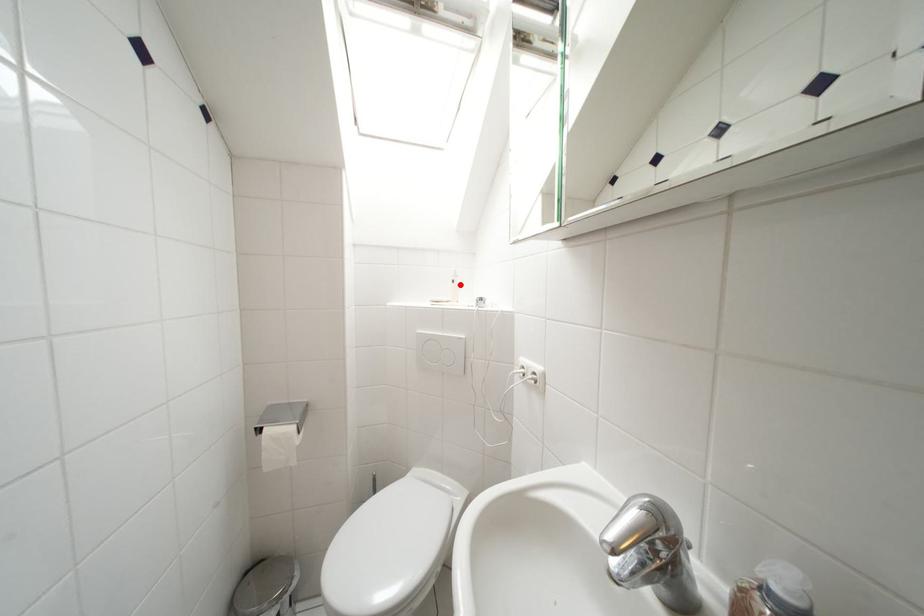
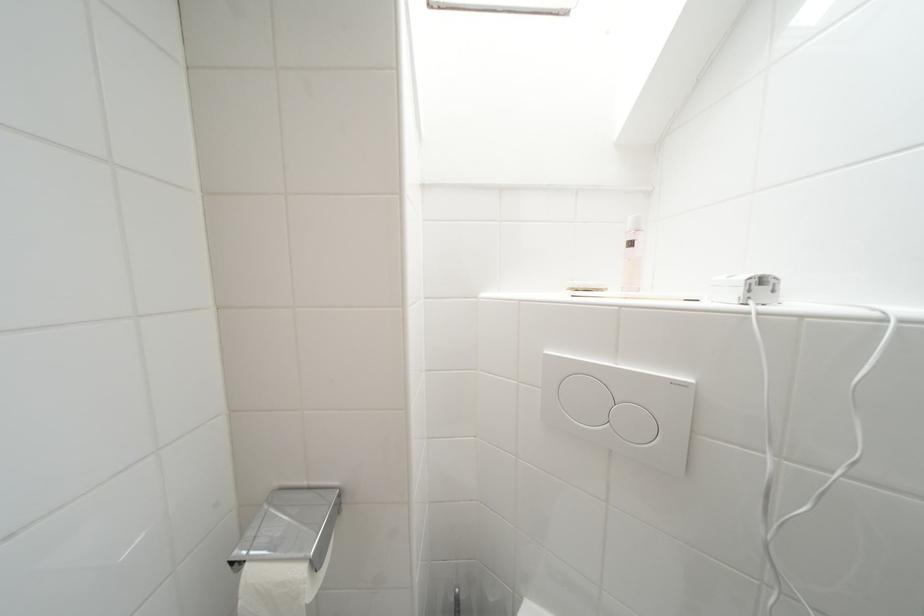
Locate, in the second image, the point that corresponds to the highlighted location in the first image.

(638, 246)